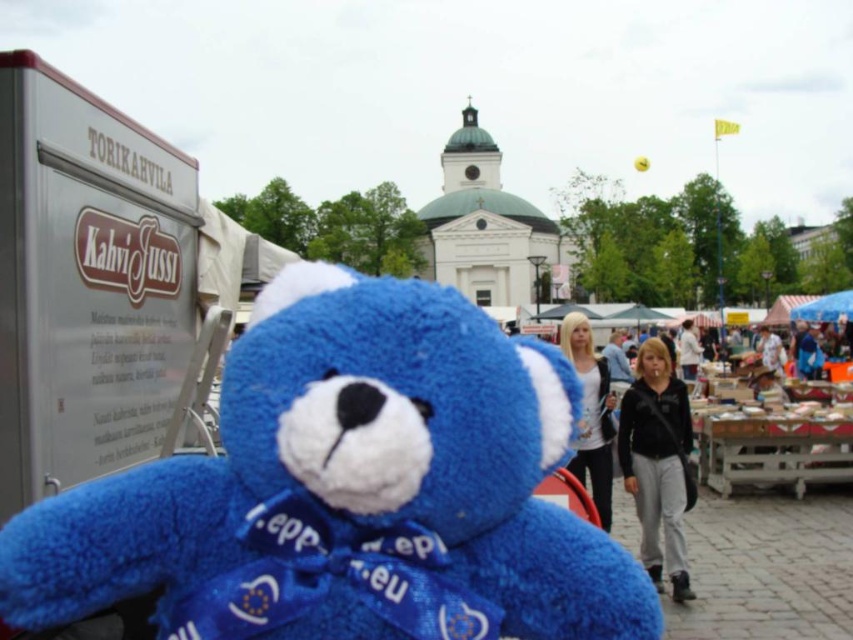
You are at the market and see both the black fleece jacket at center and the white cotton jacket at center. Which jacket is closer to you?

The black fleece jacket at center is closer to you because it is in front of the white cotton jacket at center.

You are a photographer standing at the scene. You want to take a photo of the blue teddy bear and the black fleece jacket at center. Which object is closer to the camera?

The blue teddy bear is closer to the camera than the black fleece jacket at center because the black fleece jacket at center is 90.77 meters away from the camera.

You are a photographer standing at the center of the market. You want to take a photo of the blue plush bear at center. According to the coordinates provided, where should you position yourself to capture the bear in the frame?

The blue plush bear at center is located at coordinates point (x=347, y=490). To capture it in your frame, position yourself so that your camera is aligned with these coordinates.